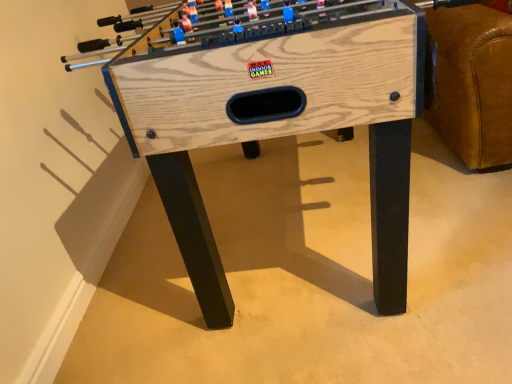
Describe the element at coordinates (276, 116) in the screenshot. I see `natural wood foosball table at center` at that location.

Identify the location of natural wood foosball table at center. (276, 116).

Identify the location of natural wood foosball table at center. (276, 116).